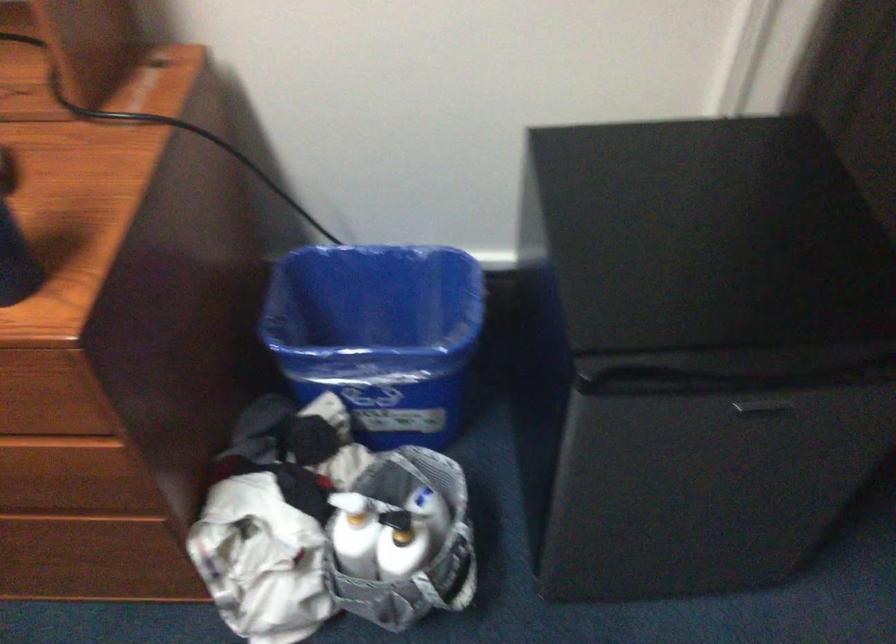
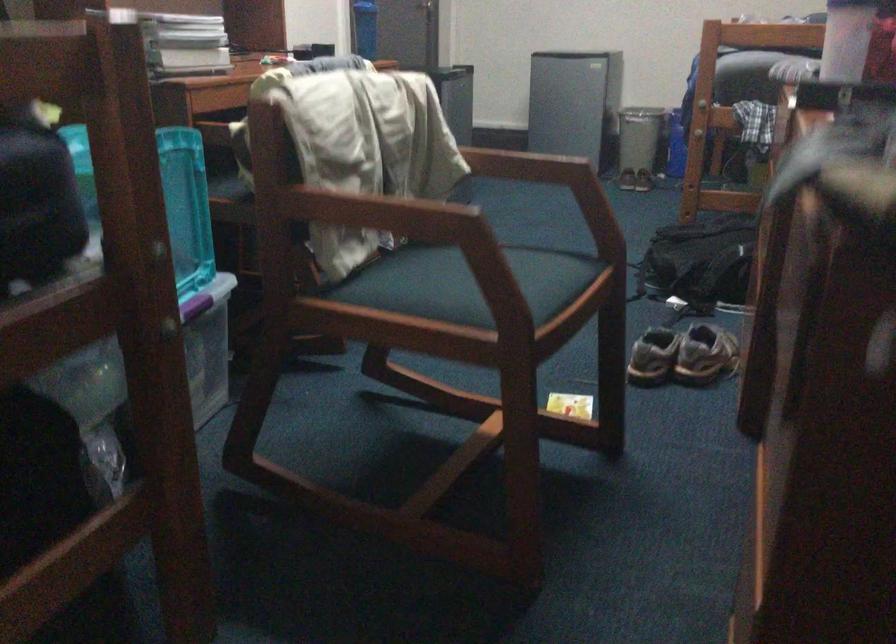
Question: I am providing you with two images of the same scene from different viewpoints. Please identify which objects are invisible in image2.

Choices:
 (A) silver trash can
 (B) black wall lamp
 (C) pair of brown shoes
 (D) blue plastic bin

Answer: (D)